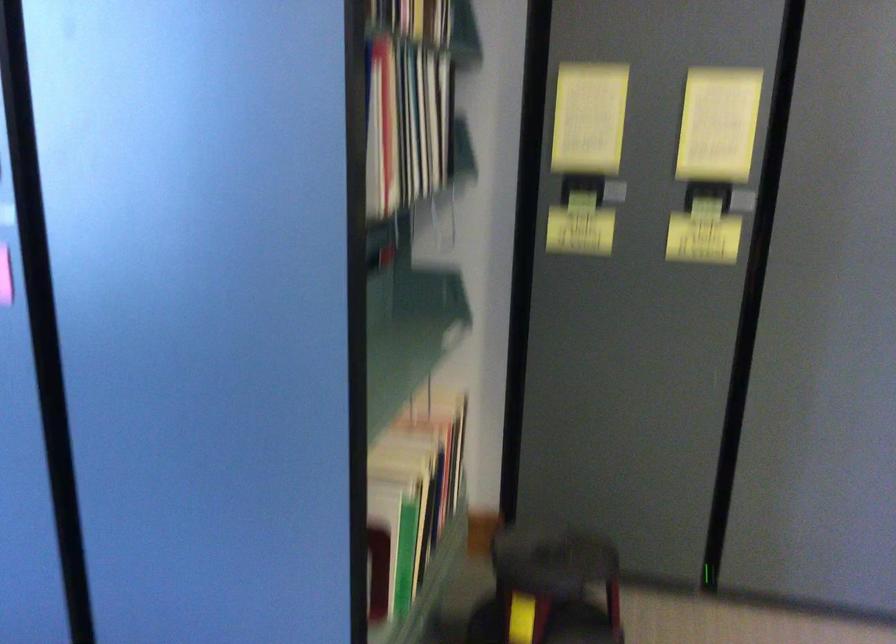
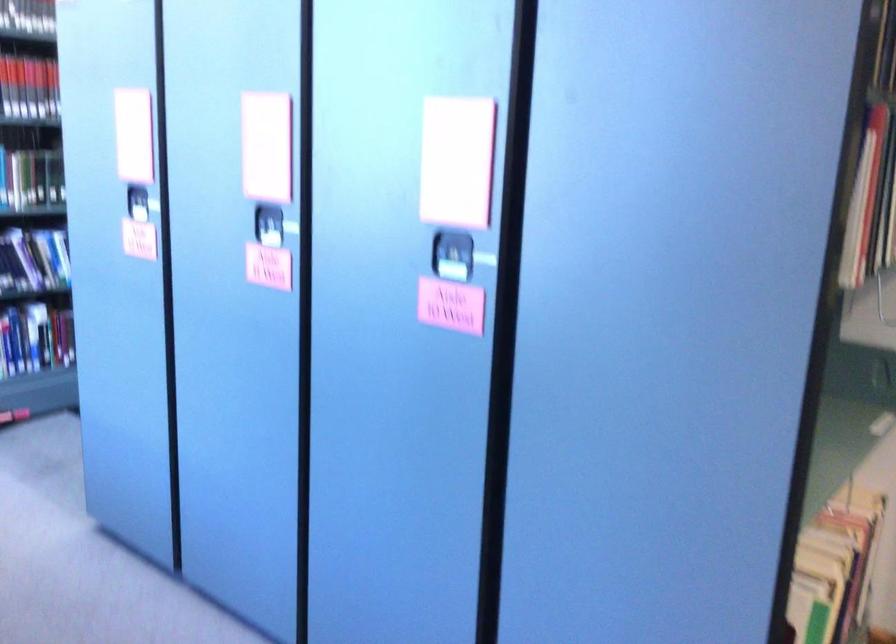
What movement of the cameraman would produce the second image?

The cameraman moved toward left, backward.